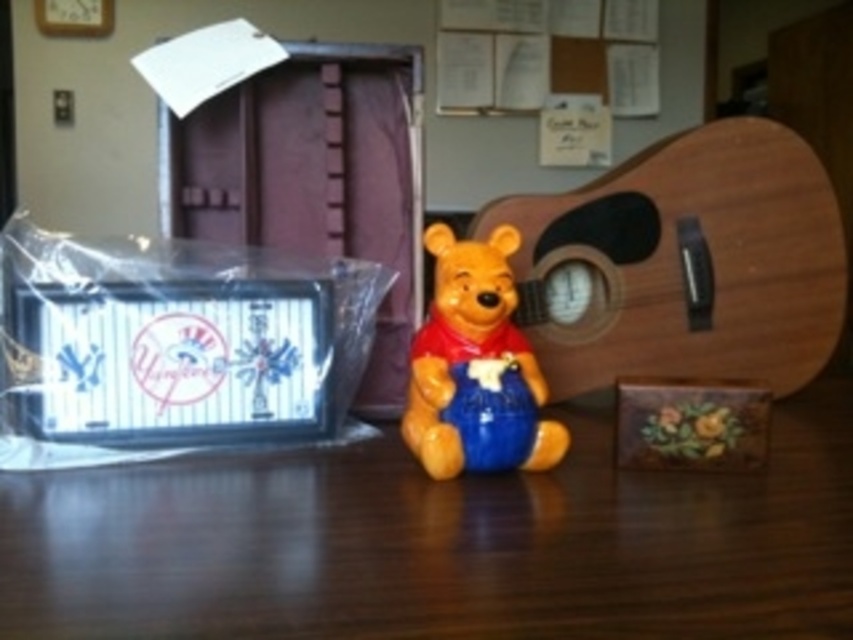
Where is `wooden at center`? Image resolution: width=853 pixels, height=640 pixels. wooden at center is located at coordinates (440, 541).

Between point (270, 556) and point (473, 296), which one is positioned in front?

Point (270, 556) is more forward.

This screenshot has height=640, width=853. I want to click on wooden at center, so click(x=440, y=541).